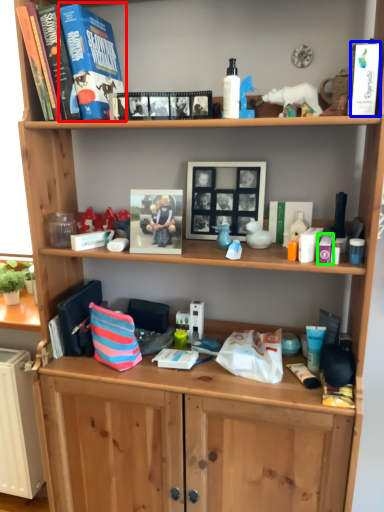
Question: Which object is the closest to the paperback book (highlighted by a red box)? Choose among these: paperback book (highlighted by a blue box) or toiletry (highlighted by a green box).

Choices:
 (A) paperback book
 (B) toiletry

Answer: (A)